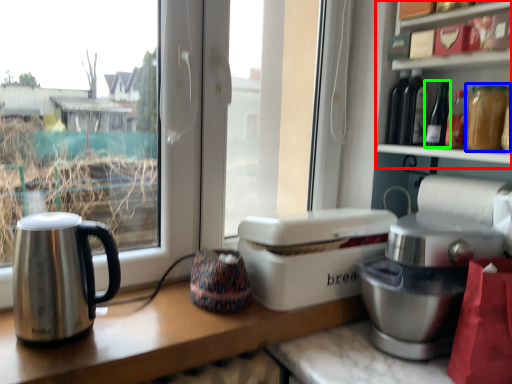
Question: Which object is the farthest from shelf (highlighted by a red box)? Choose among these: bottle (highlighted by a blue box) or bottle (highlighted by a green box).

Choices:
 (A) bottle
 (B) bottle

Answer: (A)